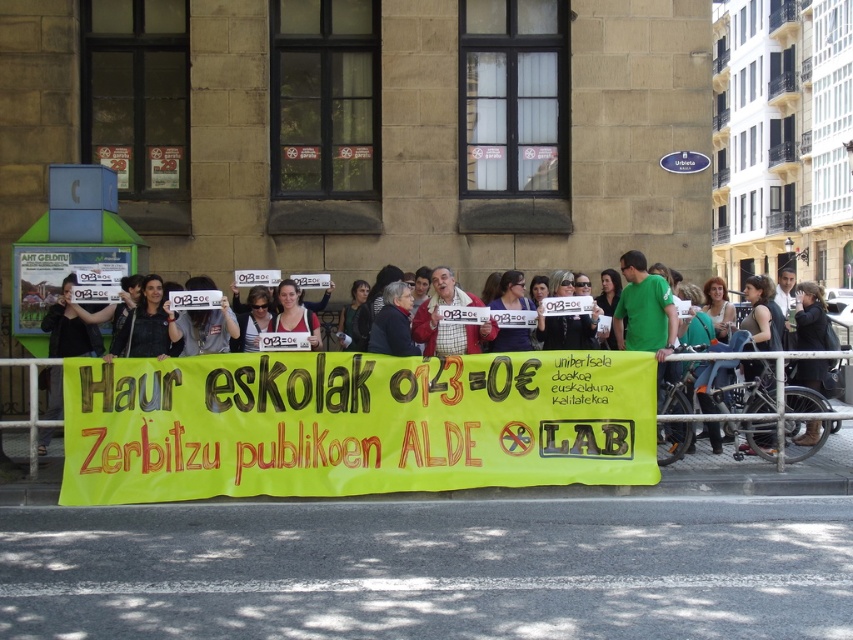
Question: Does dark gray jacket at center appear on the right side of yellow fabric banner at center?

Choices:
 (A) no
 (B) yes

Answer: (A)

Question: Among these objects, which one is farthest from the camera?

Choices:
 (A) matte white sign at center
 (B) white paper sign at center
 (C) matte black shirt at center
 (D) yellow fabric banner at center

Answer: (A)

Question: Among these points, which one is nearest to the camera?

Choices:
 (A) (271, 324)
 (B) (502, 339)
 (C) (167, 339)

Answer: (B)

Question: Can you confirm if matte black shirt at center is bigger than matte white shirt at center?

Choices:
 (A) no
 (B) yes

Answer: (B)

Question: Which of these objects is positioned farthest from the matte black shirt at center?

Choices:
 (A) white paper sign at center
 (B) matte white sign at center
 (C) matte white shirt at center
 (D) dark gray jacket at center

Answer: (B)

Question: Is matte white sign at center to the right of dark gray jacket at center from the viewer's perspective?

Choices:
 (A) no
 (B) yes

Answer: (B)